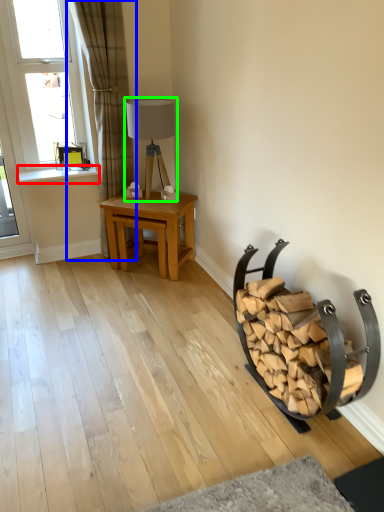
Question: Based on their relative distances, which object is farther from window sill (highlighted by a red box)? Choose from curtain (highlighted by a blue box) and table lamp (highlighted by a green box).

Choices:
 (A) curtain
 (B) table lamp

Answer: (B)